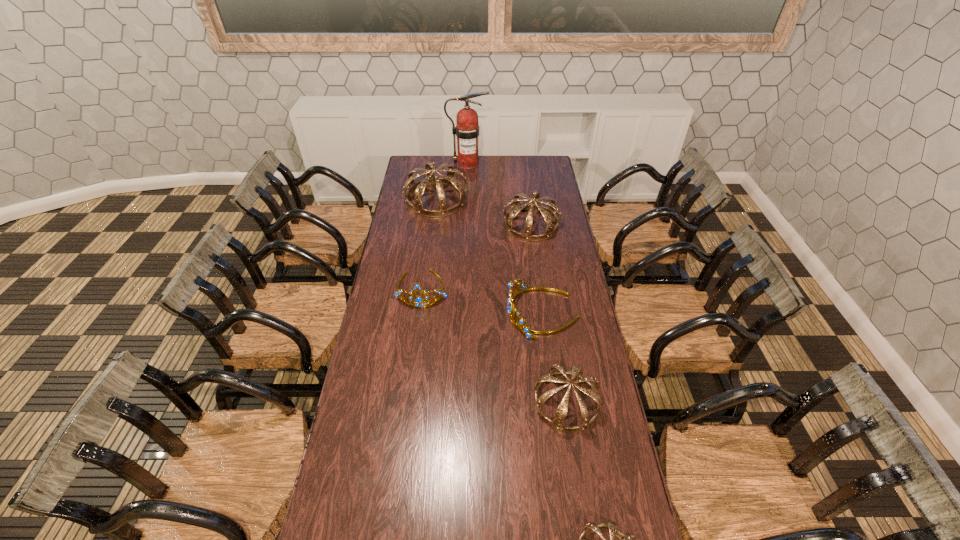
I want to click on the farthest object, so click(x=467, y=130).

Find the location of `fire extinguisher`. fire extinguisher is located at coordinates (467, 130).

In order to click on the second tallest object in this screenshot , I will do `click(418, 188)`.

Identify the location of the leftmost brown tiara. Image resolution: width=960 pixels, height=540 pixels. (418, 188).

This screenshot has width=960, height=540. In order to click on the third smallest brown tiara in this screenshot , I will do `click(548, 213)`.

The height and width of the screenshot is (540, 960). I want to click on the bigger gold tiara, so click(519, 322).

Image resolution: width=960 pixels, height=540 pixels. I want to click on the third biggest brown tiara, so click(576, 371).

The height and width of the screenshot is (540, 960). I want to click on the second nearest object, so click(576, 371).

Where is `the left gold tiara`? This screenshot has width=960, height=540. the left gold tiara is located at coordinates (418, 300).

The width and height of the screenshot is (960, 540). I want to click on vacant space situated at the nozzle of the red fire extinguisher, so click(496, 164).